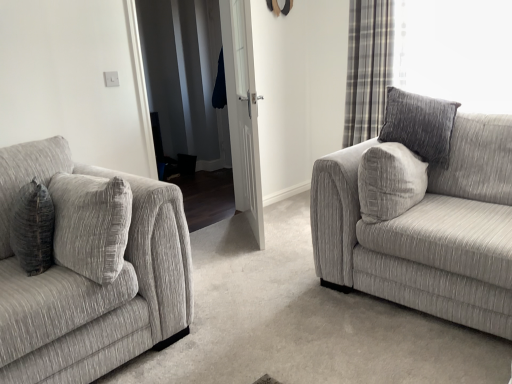
Question: From the image's perspective, is white glossy door at center located beneath textured gray couch at left, acting as the 2th studio couch starting from the right?

Choices:
 (A) no
 (B) yes

Answer: (A)

Question: Are white glossy door at center and textured gray couch at left, acting as the 2th studio couch starting from the right, located far from each other?

Choices:
 (A) yes
 (B) no

Answer: (A)

Question: Is white glossy door at center oriented towards textured gray couch at left, acting as the 2th studio couch starting from the right?

Choices:
 (A) no
 (B) yes

Answer: (A)

Question: Is white glossy door at center oriented away from textured gray couch at left, acting as the 2th studio couch starting from the right?

Choices:
 (A) yes
 (B) no

Answer: (B)

Question: Is white glossy door at center smaller than textured gray couch at left, which is counted as the first studio couch, starting from the left?

Choices:
 (A) yes
 (B) no

Answer: (A)

Question: Can you confirm if white glossy door at center is bigger than textured gray couch at left, which is counted as the first studio couch, starting from the left?

Choices:
 (A) no
 (B) yes

Answer: (A)

Question: From the image's perspective, does textured gray couch at right, marked as the 2th studio couch in a left-to-right arrangement, appear lower than white glossy door at center?

Choices:
 (A) yes
 (B) no

Answer: (A)

Question: From the image's perspective, is textured gray couch at right, marked as the 2th studio couch in a left-to-right arrangement, over white glossy door at center?

Choices:
 (A) no
 (B) yes

Answer: (A)

Question: Considering the relative sizes of textured gray couch at right, marked as the 2th studio couch in a left-to-right arrangement, and white glossy door at center in the image provided, is textured gray couch at right, marked as the 2th studio couch in a left-to-right arrangement, smaller than white glossy door at center?

Choices:
 (A) no
 (B) yes

Answer: (A)

Question: Is textured gray couch at right, marked as the 2th studio couch in a left-to-right arrangement, next to white glossy door at center?

Choices:
 (A) no
 (B) yes

Answer: (A)

Question: Is textured gray couch at right, which is counted as the first studio couch, starting from the right, wider than white glossy door at center?

Choices:
 (A) yes
 (B) no

Answer: (A)

Question: Considering the relative positions of textured gray couch at right, marked as the 2th studio couch in a left-to-right arrangement, and white glossy door at center in the image provided, is textured gray couch at right, marked as the 2th studio couch in a left-to-right arrangement, in front of white glossy door at center?

Choices:
 (A) no
 (B) yes

Answer: (B)

Question: From the image's perspective, is textured gray couch at right, which is counted as the first studio couch, starting from the right, beneath textured gray couch at left, acting as the 2th studio couch starting from the right?

Choices:
 (A) no
 (B) yes

Answer: (A)